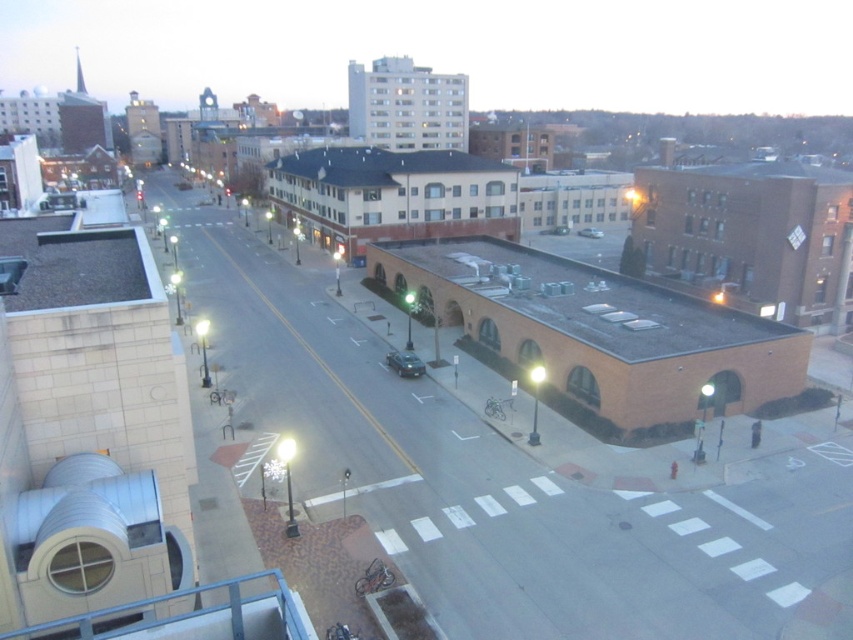
Question: Which of the following is the farthest from the observer?

Choices:
 (A) metallic silver car at center
 (B) silver metallic sedan at center

Answer: (B)

Question: Does metallic silver car at center appear on the right side of silver metallic sedan at center?

Choices:
 (A) no
 (B) yes

Answer: (A)

Question: Where is metallic silver car at center located in relation to silver metallic sedan at center in the image?

Choices:
 (A) above
 (B) below

Answer: (B)

Question: Among these objects, which one is nearest to the camera?

Choices:
 (A) silver metallic sedan at center
 (B) metallic silver car at center

Answer: (B)

Question: Is metallic silver car at center above silver metallic sedan at center?

Choices:
 (A) yes
 (B) no

Answer: (B)

Question: Which object appears closest to the camera in this image?

Choices:
 (A) metallic silver car at center
 (B) silver metallic sedan at center

Answer: (A)